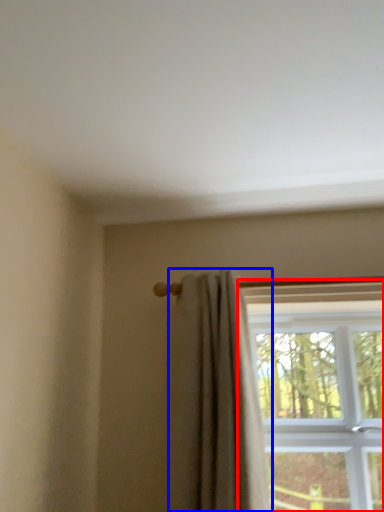
Question: Among these objects, which one is farthest to the camera, window (highlighted by a red box) or curtain (highlighted by a blue box)?

Choices:
 (A) window
 (B) curtain

Answer: (A)